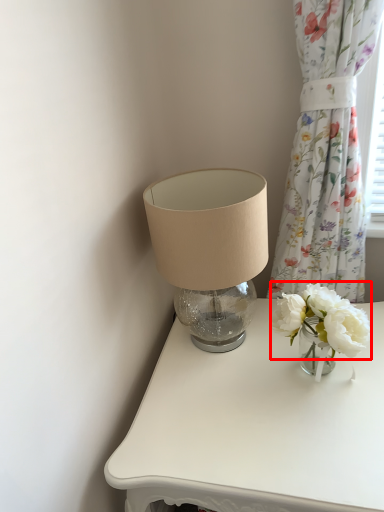
Question: In this image, where is flower (annotated by the red box) located relative to curtain?

Choices:
 (A) right
 (B) left

Answer: (B)